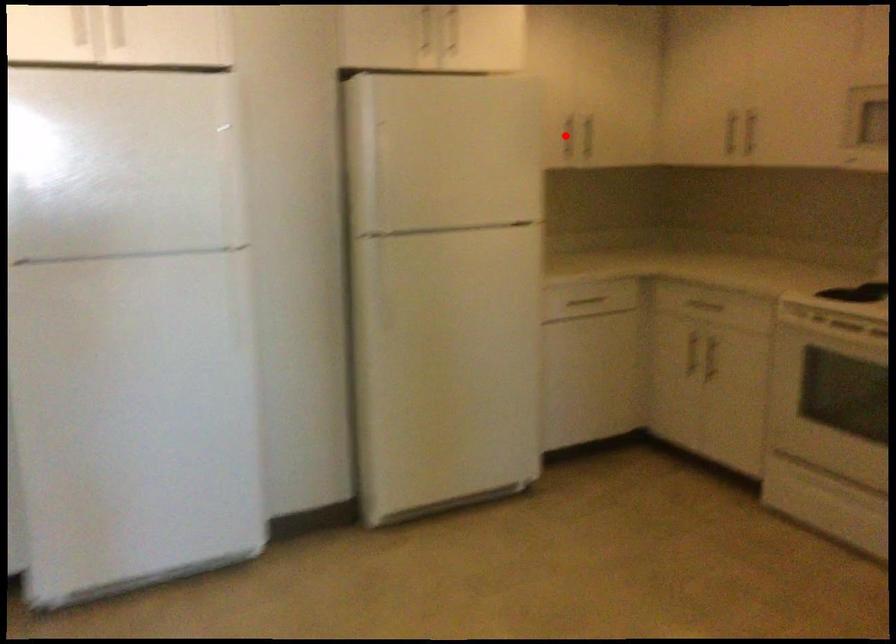
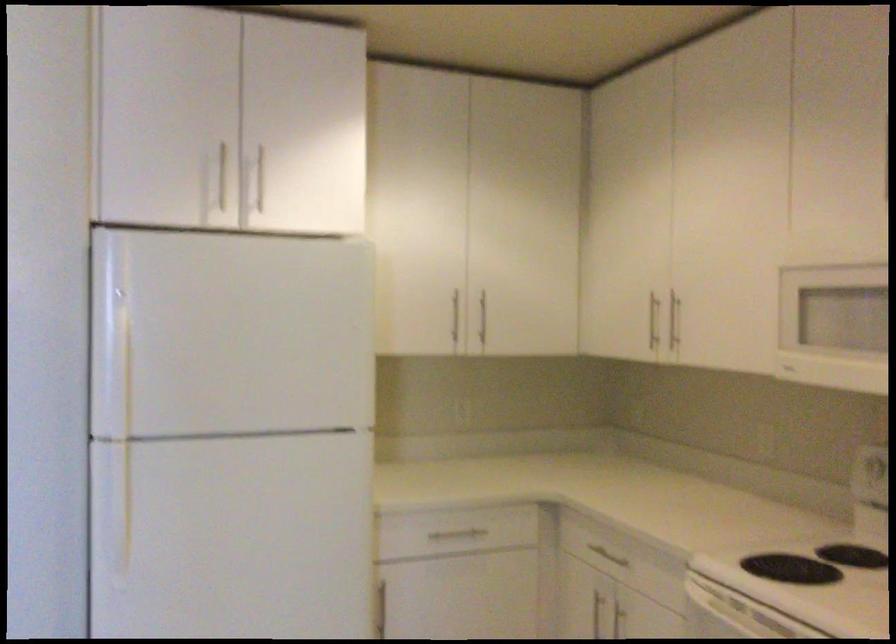
Question: I am providing you with two images of the same scene from different viewpoints. Given a red point in image1, look at the same physical point in image2. Is it:

Choices:
 (A) Closer to the viewpoint
 (B) Farther from the viewpoint

Answer: (A)